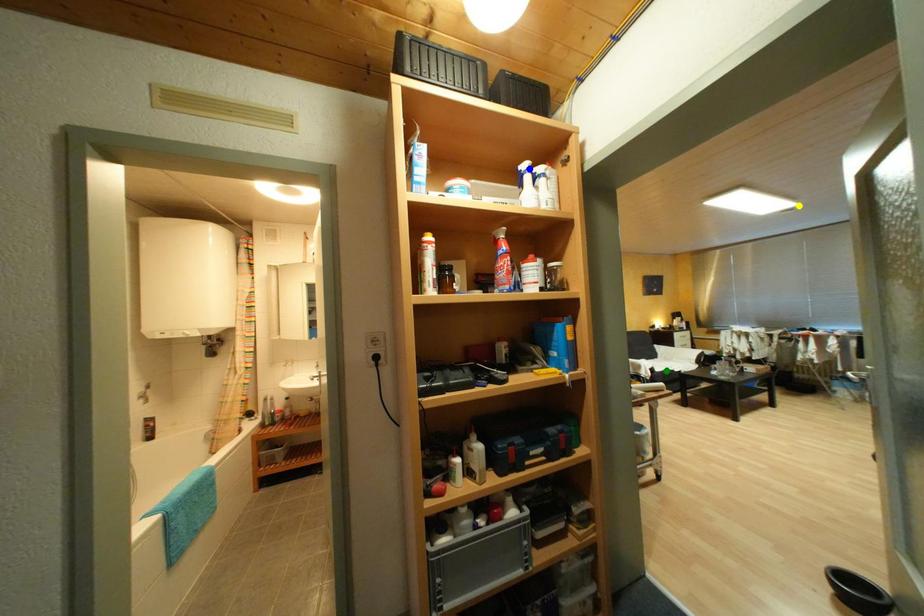
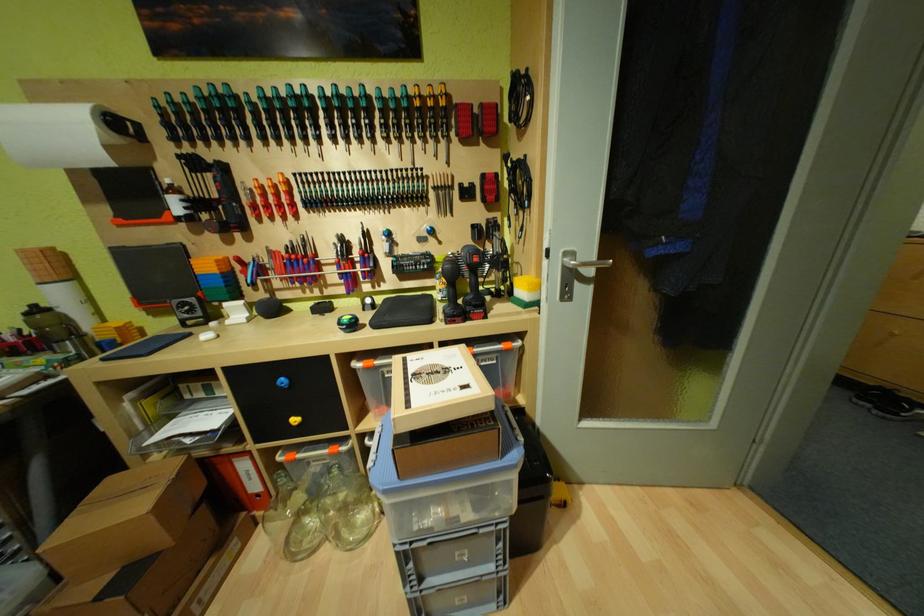
I am providing you with two images of the same scene from different viewpoints. Three points are marked in image1. Which point corresponds to a part or object that is occluded in image2?In image1, three points are marked. Which of them correspond to a part or object that is occluded in image2?Among the three points shown in image1, which one corresponds to a part or object that is no longer visible due to occlusion in image2?

blue point, green point, yellow point